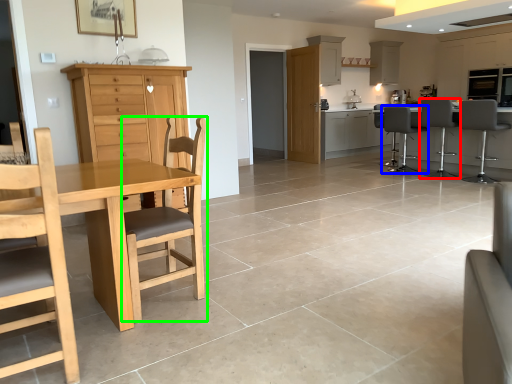
Question: Considering the real-world distances, which object is farthest from chair (highlighted by a red box)? chair (highlighted by a blue box) or chair (highlighted by a green box)?

Choices:
 (A) chair
 (B) chair

Answer: (B)